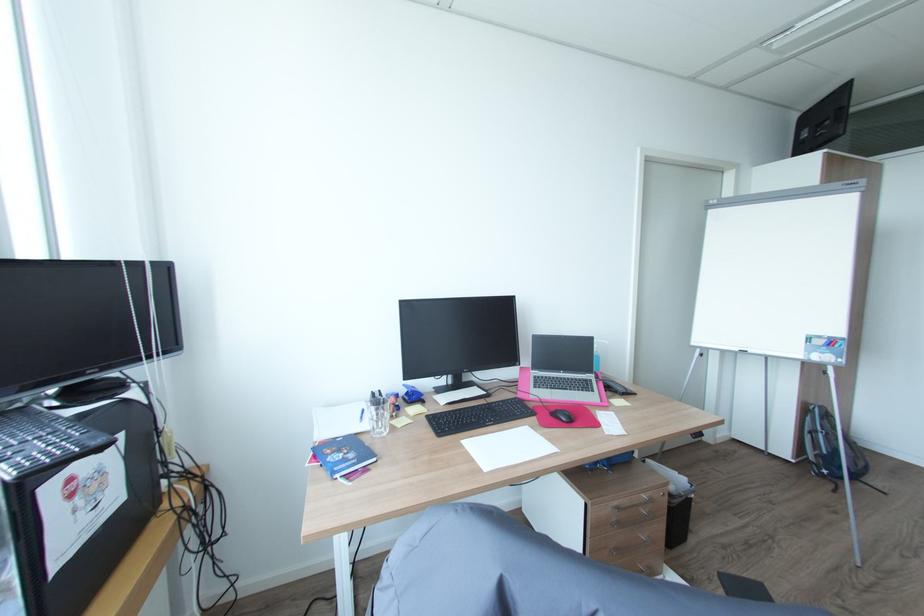
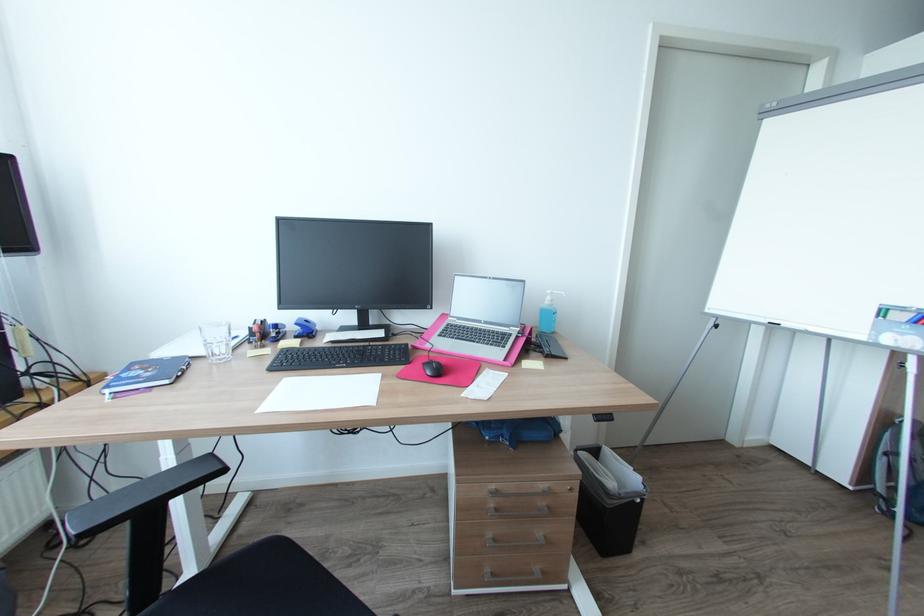
Find the pixel in the second image that matches (x=385, y=428) in the first image.

(225, 354)